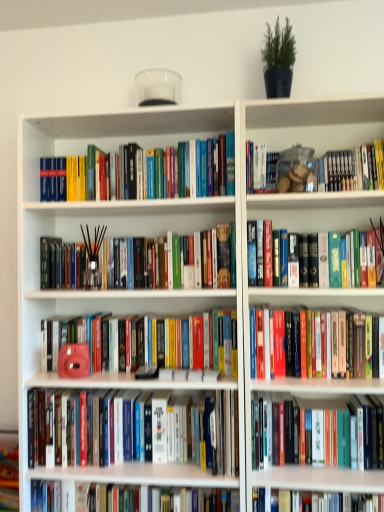
Question: Would you say hardcover book at center, positioned as the 2th book in bottom-to-top order, is to the left or to the right of matte pink camera at center, which is counted as the 3th book, starting from the bottom, in the picture?

Choices:
 (A) left
 (B) right

Answer: (B)

Question: Considering the positions of hardcover book at center, positioned as the 2th book in bottom-to-top order, and matte pink camera at center, acting as the 6th book starting from the top, in the image, is hardcover book at center, positioned as the 2th book in bottom-to-top order, bigger or smaller than matte pink camera at center, acting as the 6th book starting from the top,?

Choices:
 (A) big
 (B) small

Answer: (B)

Question: Which is nearer to the hardcover book at center, marked as the 7th book in a bottom-to-top arrangement?

Choices:
 (A) white glossy book at center, which is the first book in bottom-to-top order
 (B) hardcover book at center, positioned as the 2th book in bottom-to-top order
 (C) matte pink camera at center, the 5th book viewed from the top
 (D) black matte incense sticks at center, the 3th book when ordered from top to bottom
 (E) matte pink camera at center, which is counted as the 3th book, starting from the bottom

Answer: (B)

Question: Which object is positioned closest to the black matte incense sticks at center, acting as the 6th book starting from the bottom?

Choices:
 (A) hardcover books at center, the fourth book when ordered from top to bottom
 (B) white glossy book at center, which is the first book in bottom-to-top order
 (C) matte pink camera at center, which is the 4th book in bottom-to-top order
 (D) matte pink camera at center, acting as the 6th book starting from the top
 (E) hardcover books at upper left, the 8th book when ordered from bottom to top

Answer: (C)